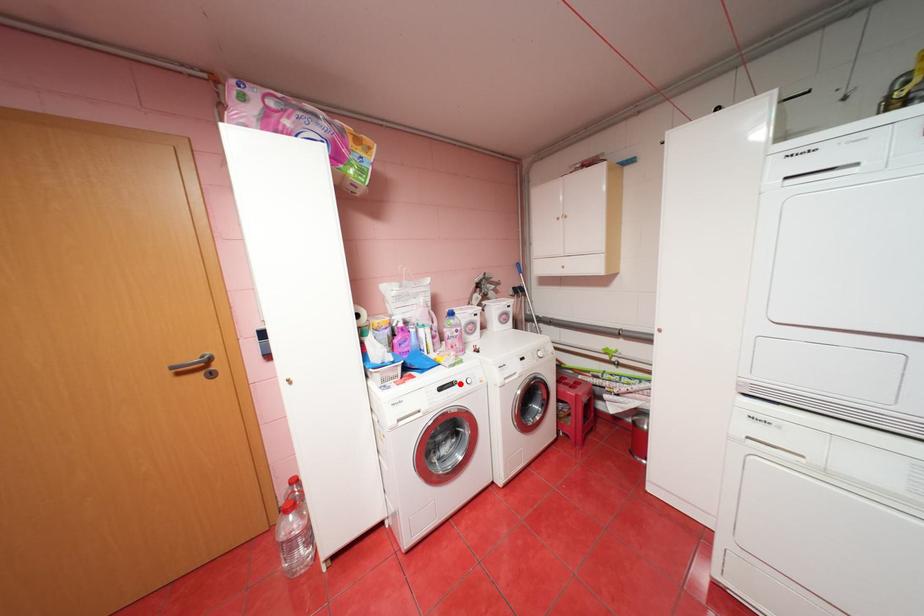
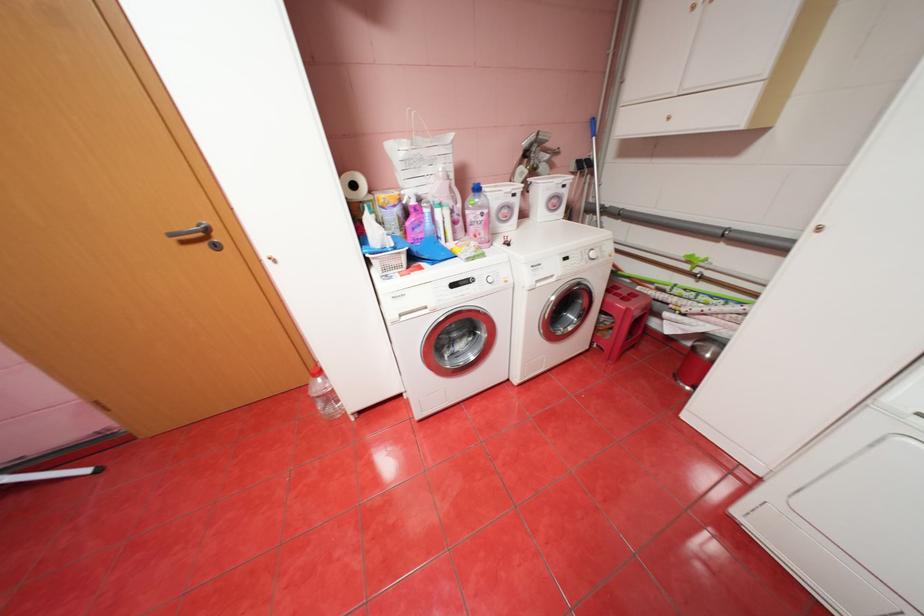
In the second image, find the point that corresponds to the highlighted location in the first image.

(476, 281)